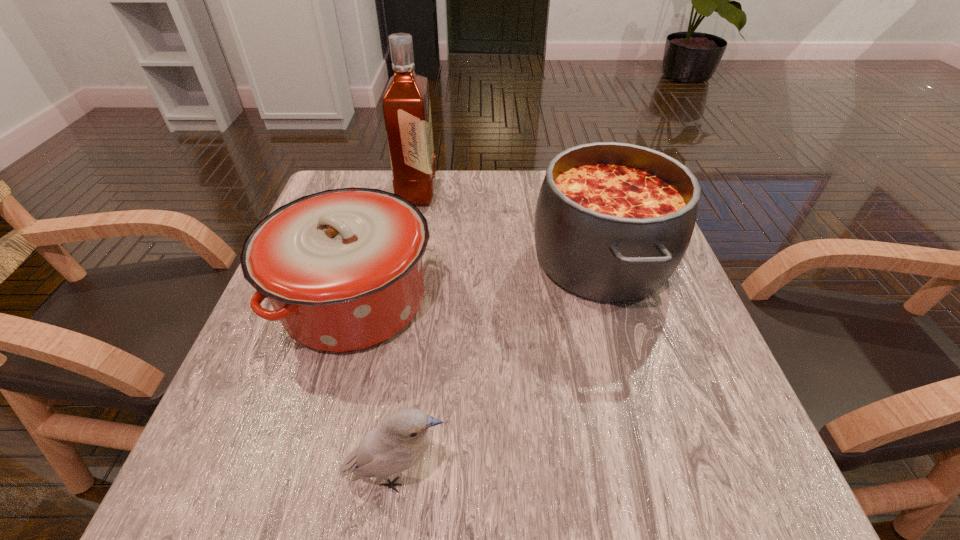
Locate an element on the screen. The width and height of the screenshot is (960, 540). casserole that is at the far edge is located at coordinates [x=613, y=221].

Find the location of a particular element. The height and width of the screenshot is (540, 960). object located at the near edge is located at coordinates (399, 443).

The height and width of the screenshot is (540, 960). In order to click on object present at the left edge in this screenshot , I will do `click(342, 268)`.

Locate an element on the screen. object that is at the right edge is located at coordinates (613, 221).

This screenshot has height=540, width=960. I want to click on object located in the far right corner section of the desktop, so point(613,221).

The image size is (960, 540). Find the location of `vacant area at the far edge`. vacant area at the far edge is located at coordinates (446, 170).

I want to click on free space at the near edge, so click(638, 500).

Identify the location of vacant space at the left edge of the desktop. (251, 364).

You are a GUI agent. You are given a task and a screenshot of the screen. Output one action in this format:
    pyautogui.click(x=<x>, y=<y>)
    Task: Click on the free space at the right edge
    Image resolution: width=960 pixels, height=540 pixels.
    Given the screenshot: What is the action you would take?
    pyautogui.click(x=694, y=322)

Identify the location of vacant area at the far left corner. The width and height of the screenshot is (960, 540). (368, 180).